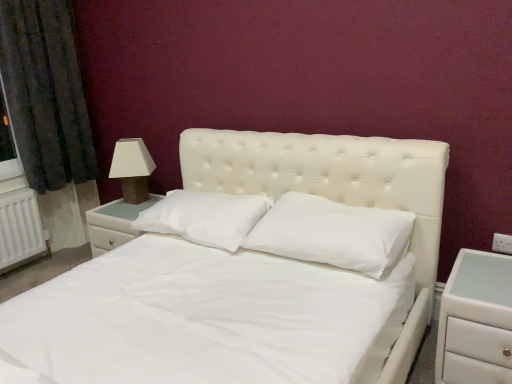
Identify the location of white soft pillow at center, the 2th pillow when ordered from left to right. (332, 233).

The width and height of the screenshot is (512, 384). Identify the location of white matte nightstand at right, arranged as the second nightstand when viewed from the back. (476, 321).

Where is `matte white lampshade at left`? This screenshot has width=512, height=384. matte white lampshade at left is located at coordinates (132, 169).

Find the location of a particular element. The height and width of the screenshot is (384, 512). white soft pillow at center, acting as the 1th pillow starting from the left is located at coordinates (204, 217).

Describe the element at coordinates (204, 217) in the screenshot. This screenshot has width=512, height=384. I see `white soft pillow at center, the second pillow positioned from the right` at that location.

Locate an element on the screen. The image size is (512, 384). white glossy nightstand at left, which appears as the 2th nightstand when viewed from the right is located at coordinates (114, 224).

Where is `white soft pillow at center, the 2th pillow when ordered from left to right`? This screenshot has height=384, width=512. white soft pillow at center, the 2th pillow when ordered from left to right is located at coordinates (332, 233).

From the picture: Is matte white lampshade at left completely or partially outside of white matte nightstand at right, placed as the first nightstand when sorted from right to left?

Absolutely, matte white lampshade at left is external to white matte nightstand at right, placed as the first nightstand when sorted from right to left.

Does matte white lampshade at left have a larger size compared to white matte nightstand at right, arranged as the second nightstand when viewed from the back?

Actually, matte white lampshade at left might be smaller than white matte nightstand at right, arranged as the second nightstand when viewed from the back.

From the image's perspective, is matte white lampshade at left located above or below white matte nightstand at right, the first nightstand in the front-to-back sequence?

matte white lampshade at left is above white matte nightstand at right, the first nightstand in the front-to-back sequence.

Is point (133, 159) more distant than point (448, 373)?

That is True.

How many degrees apart are the facing directions of white soft pillow at center, the second pillow positioned from the right, and matte white lampshade at left?

1.79 degrees separate the facing orientations of white soft pillow at center, the second pillow positioned from the right, and matte white lampshade at left.

Considering the positions of objects white soft pillow at center, the second pillow positioned from the right, and matte white lampshade at left in the image provided, who is in front, white soft pillow at center, the second pillow positioned from the right, or matte white lampshade at left?

white soft pillow at center, the second pillow positioned from the right, is more forward.

Consider the image. Is white soft pillow at center, the second pillow positioned from the right, oriented towards matte white lampshade at left?

No, white soft pillow at center, the second pillow positioned from the right, is not turned towards matte white lampshade at left.

Which object is wider, white soft pillow at center, acting as the 1th pillow starting from the left, or matte white lampshade at left?

white soft pillow at center, acting as the 1th pillow starting from the left.

Is the position of white soft pillow at center, marked as the first pillow in a right-to-left arrangement, less distant than that of matte white lampshade at left?

Yes, white soft pillow at center, marked as the first pillow in a right-to-left arrangement, is in front of matte white lampshade at left.

Considering the relative sizes of white soft pillow at center, the 2th pillow when ordered from left to right, and matte white lampshade at left in the image provided, is white soft pillow at center, the 2th pillow when ordered from left to right, thinner than matte white lampshade at left?

Incorrect, the width of white soft pillow at center, the 2th pillow when ordered from left to right, is not less than that of matte white lampshade at left.

From the picture: How different are the orientations of white soft pillow at center, marked as the first pillow in a right-to-left arrangement, and matte white lampshade at left in degrees?

The facing directions of white soft pillow at center, marked as the first pillow in a right-to-left arrangement, and matte white lampshade at left are 1.79 degrees apart.

Which is more to the left, white soft pillow at center, marked as the first pillow in a right-to-left arrangement, or matte white lampshade at left?

matte white lampshade at left is more to the left.

From a real-world perspective, is matte white lampshade at left physically located above or below white glossy nightstand at left, the first nightstand when ordered from back to front?

matte white lampshade at left is situated higher than white glossy nightstand at left, the first nightstand when ordered from back to front, in the real world.

Where is `lamp on the left of the white glossy nightstand at left, which appears as the 2th nightstand when viewed from the right`? This screenshot has height=384, width=512. lamp on the left of the white glossy nightstand at left, which appears as the 2th nightstand when viewed from the right is located at coordinates pos(132,169).

From the image's perspective, which one is positioned higher, matte white lampshade at left or white glossy nightstand at left, placed as the first nightstand when sorted from left to right?

matte white lampshade at left is shown above in the image.

Is matte white lampshade at left to the left of white glossy nightstand at left, placed as the first nightstand when sorted from left to right, from the viewer's perspective?

Indeed, matte white lampshade at left is positioned on the left side of white glossy nightstand at left, placed as the first nightstand when sorted from left to right.

Can you see white glossy nightstand at left, which appears as the second nightstand when viewed from the front, touching white matte nightstand at right, arranged as the second nightstand when viewed from the back?

No, white glossy nightstand at left, which appears as the second nightstand when viewed from the front, is not touching white matte nightstand at right, arranged as the second nightstand when viewed from the back.

What's the angular difference between white glossy nightstand at left, which appears as the 2th nightstand when viewed from the right, and white matte nightstand at right, placed as the first nightstand when sorted from right to left,'s facing directions?

There is a 1.05-degree angle between the facing directions of white glossy nightstand at left, which appears as the 2th nightstand when viewed from the right, and white matte nightstand at right, placed as the first nightstand when sorted from right to left.

Can you confirm if white glossy nightstand at left, which appears as the second nightstand when viewed from the front, is shorter than white matte nightstand at right, the first nightstand in the front-to-back sequence?

Yes.

From a real-world perspective, is white glossy nightstand at left, which appears as the second nightstand when viewed from the front, over white matte nightstand at right, placed as the first nightstand when sorted from right to left?

Yes, from a real-world perspective, white glossy nightstand at left, which appears as the second nightstand when viewed from the front, is above white matte nightstand at right, placed as the first nightstand when sorted from right to left.

In terms of height, does white soft pillow at center, the 2th pillow when ordered from left to right, look taller or shorter compared to white matte nightstand at right, placed as the first nightstand when sorted from right to left?

Clearly, white soft pillow at center, the 2th pillow when ordered from left to right, is shorter compared to white matte nightstand at right, placed as the first nightstand when sorted from right to left.

Is white soft pillow at center, the 2th pillow when ordered from left to right, next to white matte nightstand at right, arranged as the second nightstand when viewed from the back?

No, white soft pillow at center, the 2th pillow when ordered from left to right, is not touching white matte nightstand at right, arranged as the second nightstand when viewed from the back.

Does white soft pillow at center, marked as the first pillow in a right-to-left arrangement, lie in front of white matte nightstand at right, the 2th nightstand from the left?

No.

Is white matte nightstand at right, arranged as the second nightstand when viewed from the back, a part of white soft pillow at center, marked as the first pillow in a right-to-left arrangement?

No.

Between white glossy nightstand at left, placed as the first nightstand when sorted from left to right, and matte white lampshade at left, which one appears on the left side from the viewer's perspective?

Positioned to the left is matte white lampshade at left.

From the image's perspective, is white glossy nightstand at left, placed as the first nightstand when sorted from left to right, beneath matte white lampshade at left?

Correct, white glossy nightstand at left, placed as the first nightstand when sorted from left to right, appears lower than matte white lampshade at left in the image.

Considering the sizes of white glossy nightstand at left, which appears as the 2th nightstand when viewed from the right, and matte white lampshade at left in the image, is white glossy nightstand at left, which appears as the 2th nightstand when viewed from the right, bigger or smaller than matte white lampshade at left?

Clearly, white glossy nightstand at left, which appears as the 2th nightstand when viewed from the right, is larger in size than matte white lampshade at left.

I want to click on lamp above the white matte nightstand at right, placed as the first nightstand when sorted from right to left (from the image's perspective), so click(x=132, y=169).

Find the location of a particular element. the 1st pillow counting from the right of the matte white lampshade at left is located at coordinates (204, 217).

Estimate the real-world distances between objects in this image. Which object is further from white matte nightstand at right, the first nightstand in the front-to-back sequence, matte white lampshade at left or white soft pillow at center, acting as the 1th pillow starting from the left?

matte white lampshade at left.

When comparing their distances from white soft pillow at center, acting as the 1th pillow starting from the left, does white soft pillow at center, the 2th pillow when ordered from left to right, or matte white lampshade at left seem further?

matte white lampshade at left.

Estimate the real-world distances between objects in this image. Which object is closer to white soft pillow at center, the 2th pillow when ordered from left to right, white glossy nightstand at left, which appears as the second nightstand when viewed from the front, or white soft pillow at center, the second pillow positioned from the right?

white soft pillow at center, the second pillow positioned from the right, lies closer to white soft pillow at center, the 2th pillow when ordered from left to right, than the other object.

Which object lies nearer to the anchor point white soft pillow at center, the second pillow positioned from the right, matte white lampshade at left or white soft pillow at center, the 2th pillow when ordered from left to right?

Among the two, white soft pillow at center, the 2th pillow when ordered from left to right, is located nearer to white soft pillow at center, the second pillow positioned from the right.

Considering their positions, is white glossy nightstand at left, which appears as the second nightstand when viewed from the front, positioned further to matte white lampshade at left than white soft pillow at center, the 2th pillow when ordered from left to right?

white soft pillow at center, the 2th pillow when ordered from left to right, is positioned further to the anchor matte white lampshade at left.

Considering their positions, is matte white lampshade at left positioned further to white matte nightstand at right, the 2th nightstand from the left, than white soft pillow at center, the 2th pillow when ordered from left to right?

The object further to white matte nightstand at right, the 2th nightstand from the left, is matte white lampshade at left.

Looking at the image, which one is located further to matte white lampshade at left, white glossy nightstand at left, placed as the first nightstand when sorted from left to right, or white soft pillow at center, the second pillow positioned from the right?

Among the two, white soft pillow at center, the second pillow positioned from the right, is located further to matte white lampshade at left.

Considering their positions, is matte white lampshade at left positioned further to white soft pillow at center, marked as the first pillow in a right-to-left arrangement, than white matte nightstand at right, arranged as the second nightstand when viewed from the back?

Result: matte white lampshade at left.

Locate an element on the screen. nightstand located between matte white lampshade at left and white matte nightstand at right, the 2th nightstand from the left, in the left-right direction is located at coordinates (114, 224).

I want to click on pillow located between white glossy nightstand at left, the first nightstand when ordered from back to front, and white soft pillow at center, the 2th pillow when ordered from left to right, in the left-right direction, so click(x=204, y=217).

Where is `pillow between white soft pillow at center, the second pillow positioned from the right, and white matte nightstand at right, the 2th nightstand from the left`? pillow between white soft pillow at center, the second pillow positioned from the right, and white matte nightstand at right, the 2th nightstand from the left is located at coordinates (332, 233).

At what (x,y) coordinates should I click in order to perform the action: click on pillow between matte white lampshade at left and white soft pillow at center, the 2th pillow when ordered from left to right, from left to right. Please return your answer as a coordinate pair (x, y). This screenshot has width=512, height=384. Looking at the image, I should click on click(x=204, y=217).